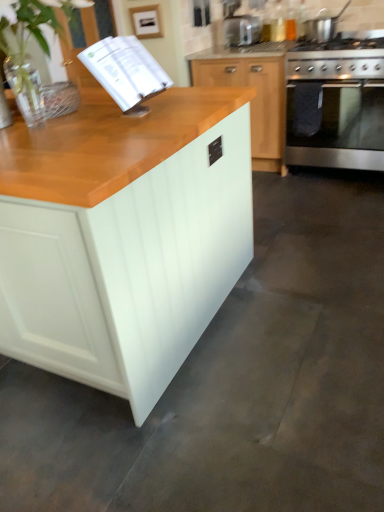
The image size is (384, 512). In order to click on free space to the right of green leafy plant at upper left in this screenshot , I will do `click(160, 123)`.